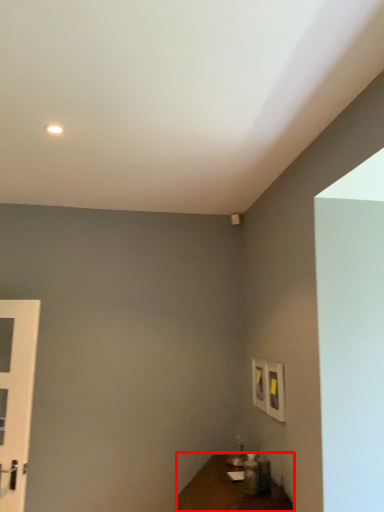
Question: Considering the relative positions of table (annotated by the red box) and door in the image provided, where is table (annotated by the red box) located with respect to the staircase?

Choices:
 (A) left
 (B) right

Answer: (B)